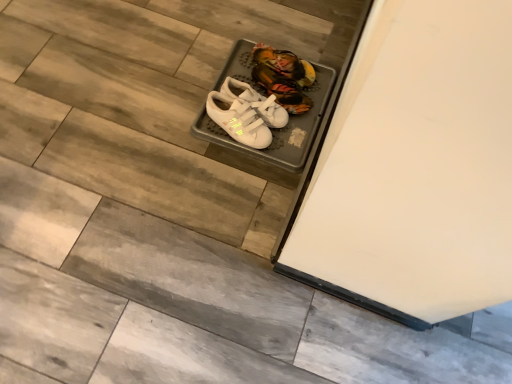
Question: Is white matte sneakers at center, positioned as the 2th footwear in front-to-back order, outside of white velcro sneakers at center, the 3th footwear when ordered from front to back?

Choices:
 (A) yes
 (B) no

Answer: (A)

Question: From a real-world perspective, is white matte sneakers at center, positioned as the 2th footwear in front-to-back order, on white velcro sneakers at center, the 3th footwear when ordered from front to back?

Choices:
 (A) no
 (B) yes

Answer: (B)

Question: Are white matte sneakers at center, positioned as the 2th footwear in front-to-back order, and white velcro sneakers at center, which is the first footwear in back-to-front order, located far from each other?

Choices:
 (A) no
 (B) yes

Answer: (A)

Question: From the image's perspective, would you say white matte sneakers at center, positioned as the 2th footwear in front-to-back order, is shown under white velcro sneakers at center, which is the first footwear in back-to-front order?

Choices:
 (A) no
 (B) yes

Answer: (B)

Question: Considering the relative positions of white matte sneakers at center, which is the 2th footwear in back-to-front order, and white velcro sneakers at center, the 3th footwear when ordered from front to back, in the image provided, is white matte sneakers at center, which is the 2th footwear in back-to-front order, in front of white velcro sneakers at center, the 3th footwear when ordered from front to back,?

Choices:
 (A) no
 (B) yes

Answer: (B)

Question: In terms of size, does white velcro sneakers at center, which is the first footwear in back-to-front order, appear bigger or smaller than white velcro sneakers at center, positioned as the 1th footwear in front-to-back order?

Choices:
 (A) big
 (B) small

Answer: (B)

Question: Based on their positions, is white velcro sneakers at center, which is the first footwear in back-to-front order, located to the left or right of white velcro sneakers at center, which appears as the third footwear when viewed from the back?

Choices:
 (A) right
 (B) left

Answer: (A)

Question: Is white velcro sneakers at center, which is the first footwear in back-to-front order, taller or shorter than white velcro sneakers at center, which appears as the third footwear when viewed from the back?

Choices:
 (A) short
 (B) tall

Answer: (A)

Question: From a real-world perspective, is white velcro sneakers at center, the 3th footwear when ordered from front to back, positioned above or below white velcro sneakers at center, which appears as the third footwear when viewed from the back?

Choices:
 (A) below
 (B) above

Answer: (A)

Question: Considering the positions of white velcro sneakers at center, positioned as the 1th footwear in front-to-back order, and white velcro sneakers at center, which is the first footwear in back-to-front order, in the image, is white velcro sneakers at center, positioned as the 1th footwear in front-to-back order, wider or thinner than white velcro sneakers at center, which is the first footwear in back-to-front order,?

Choices:
 (A) wide
 (B) thin

Answer: (A)

Question: Is white velcro sneakers at center, which appears as the third footwear when viewed from the back, to the left or to the right of white velcro sneakers at center, the 3th footwear when ordered from front to back, in the image?

Choices:
 (A) left
 (B) right

Answer: (A)

Question: Is point (254, 124) positioned closer to the camera than point (274, 76)?

Choices:
 (A) closer
 (B) farther

Answer: (A)

Question: Relative to white velcro sneakers at center, which is the first footwear in back-to-front order, is white velcro sneakers at center, which appears as the third footwear when viewed from the back, in front or behind?

Choices:
 (A) behind
 (B) front

Answer: (B)

Question: Considering the positions of white velcro sneakers at center, which is the first footwear in back-to-front order, and white matte sneakers at center, positioned as the 2th footwear in front-to-back order, in the image, is white velcro sneakers at center, which is the first footwear in back-to-front order, taller or shorter than white matte sneakers at center, positioned as the 2th footwear in front-to-back order,?

Choices:
 (A) short
 (B) tall

Answer: (A)

Question: From the image's perspective, is white velcro sneakers at center, the 3th footwear when ordered from front to back, above or below white matte sneakers at center, which is the 2th footwear in back-to-front order?

Choices:
 (A) below
 (B) above

Answer: (B)